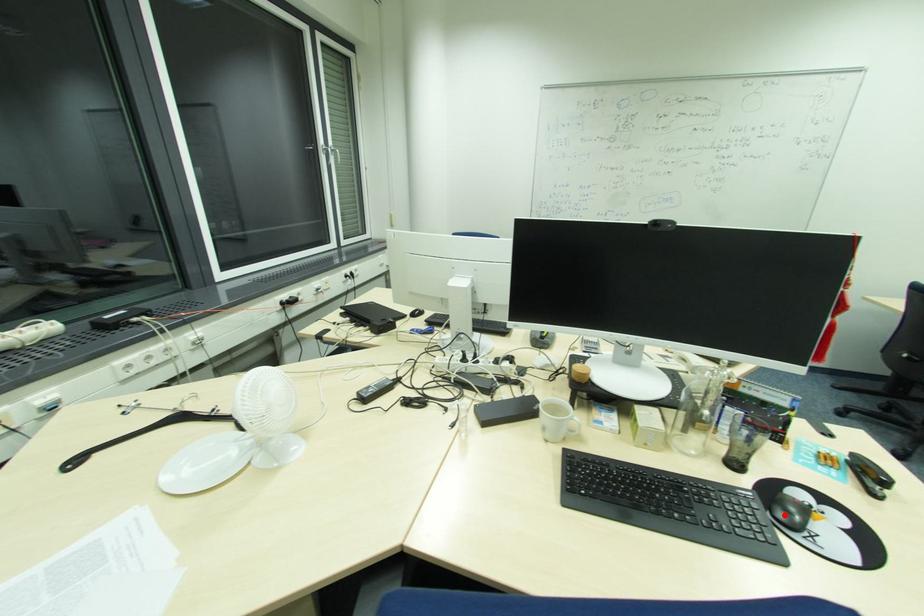
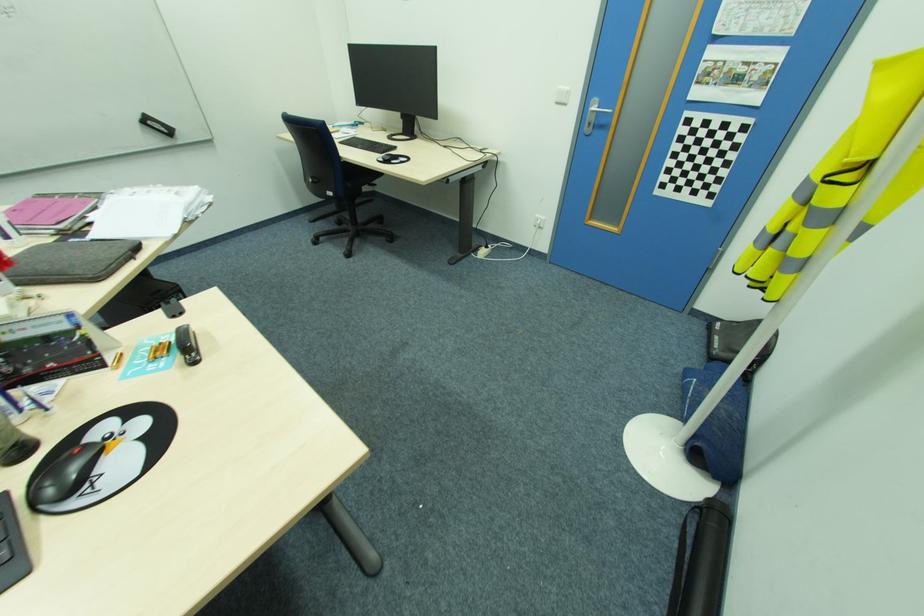
Where in the second image is the point corresponding to the highlighted location from the first image?

(54, 490)